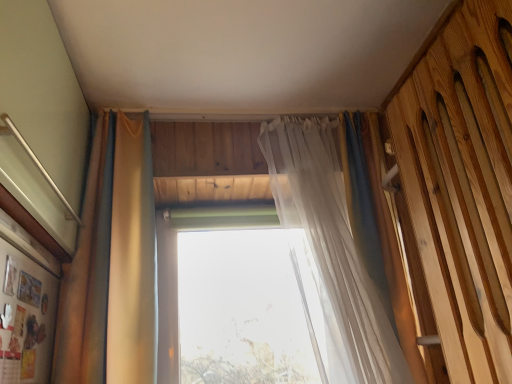
Question: Would you say matte gold curtain at left, placed as the first curtain when sorted from left to right, is to the left or to the right of translucent fabric curtain at center, positioned as the second curtain in left-to-right order, in the picture?

Choices:
 (A) left
 (B) right

Answer: (A)

Question: Which is correct: matte gold curtain at left, which is the 2th curtain from right to left, is inside translucent fabric curtain at center, positioned as the second curtain in left-to-right order, or outside of it?

Choices:
 (A) outside
 (B) inside

Answer: (A)

Question: Which of these objects is positioned farthest from the matte gold curtain at left, which is the 2th curtain from right to left?

Choices:
 (A) wooden slats bed at right
 (B) translucent fabric curtain at center, positioned as the second curtain in left-to-right order
 (C) transparent glass window at center

Answer: (A)

Question: Based on their relative distances, which object is farther from the wooden slats bed at right?

Choices:
 (A) matte gold curtain at left, placed as the first curtain when sorted from left to right
 (B) transparent glass window at center
 (C) translucent fabric curtain at center, positioned as the second curtain in left-to-right order

Answer: (A)